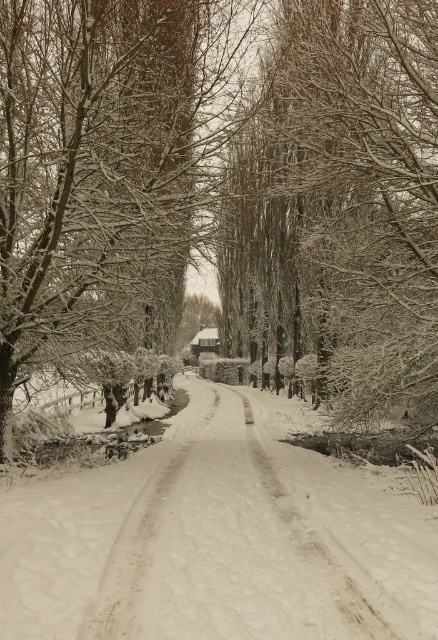
You are standing at the point labeled as point (342, 204) in the image. What do you see directly in front of you?

You see snow covered trees at center directly in front of you because the point (342, 204) corresponds to snow covered trees at center.